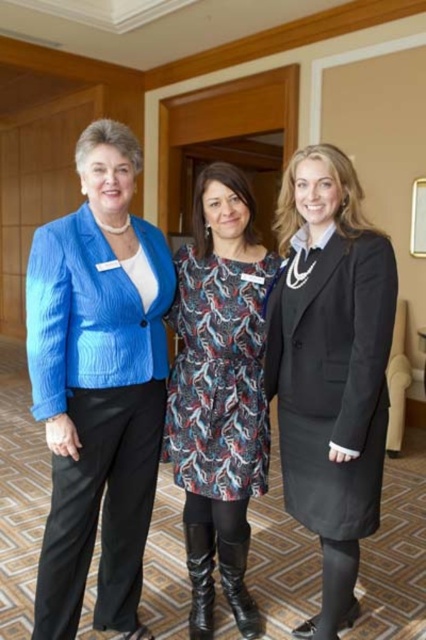
Is matte blue blazer at left closer to camera compared to matte black suit at center?

No.

Is point (146, 356) behind point (271, 376)?

That is False.

Who is more forward, (51, 408) or (389, 268)?

Positioned in front is point (389, 268).

Where is `matte blue blazer at left`? This screenshot has width=426, height=640. matte blue blazer at left is located at coordinates (95, 412).

Which is in front, point (66, 284) or point (245, 456)?

Point (66, 284)

Is matte blue blazer at left in front of printed fabric dress at center?

Yes, it is.

Is point (65, 616) less distant than point (206, 269)?

That is True.

This screenshot has height=640, width=426. Identify the location of matte blue blazer at left. (95, 412).

Does matte black suit at center have a greater height compared to printed fabric dress at center?

Yes, matte black suit at center is taller than printed fabric dress at center.

Between matte black suit at center and printed fabric dress at center, which one appears on the right side from the viewer's perspective?

Positioned to the right is matte black suit at center.

Who is more forward, (337, 365) or (259, 474)?

Positioned in front is point (337, 365).

This screenshot has height=640, width=426. I want to click on matte black suit at center, so click(331, 365).